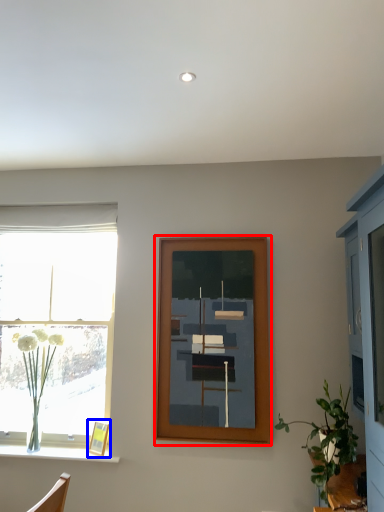
Question: Which object appears closest to the camera in this image, picture frame (highlighted by a red box) or picture frame (highlighted by a blue box)?

Choices:
 (A) picture frame
 (B) picture frame

Answer: (A)